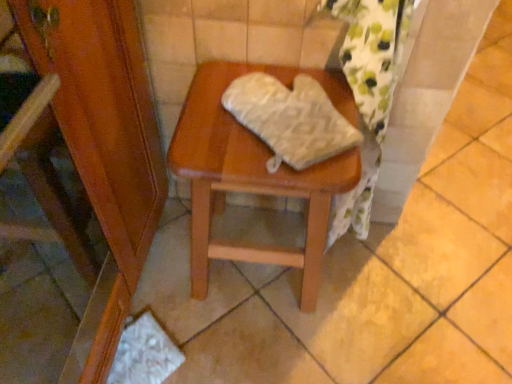
Find the location of a particular element. free space above wooden stool at center (from a real-world perspective) is located at coordinates coord(262,134).